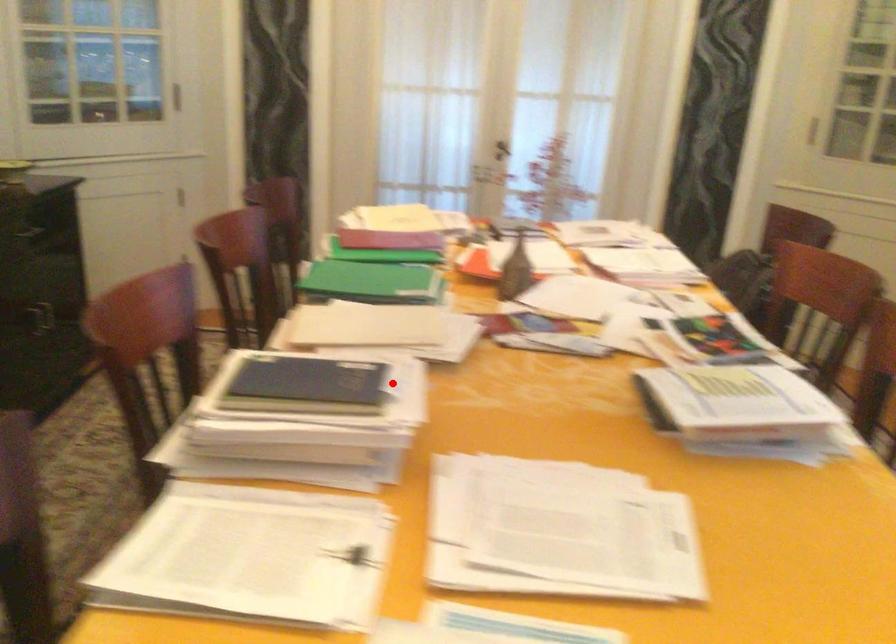
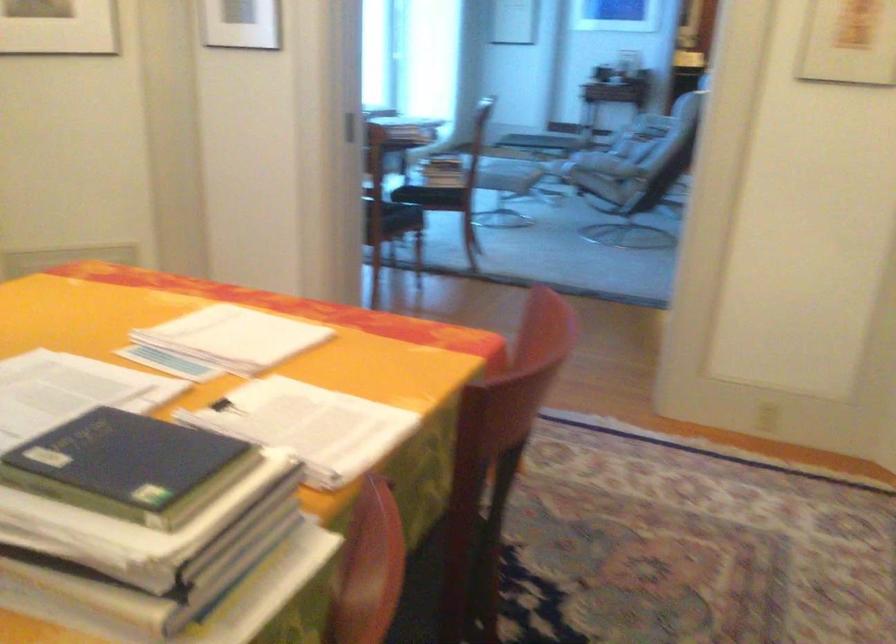
In the second image, find the point that corresponds to the highlighted location in the first image.

(128, 466)